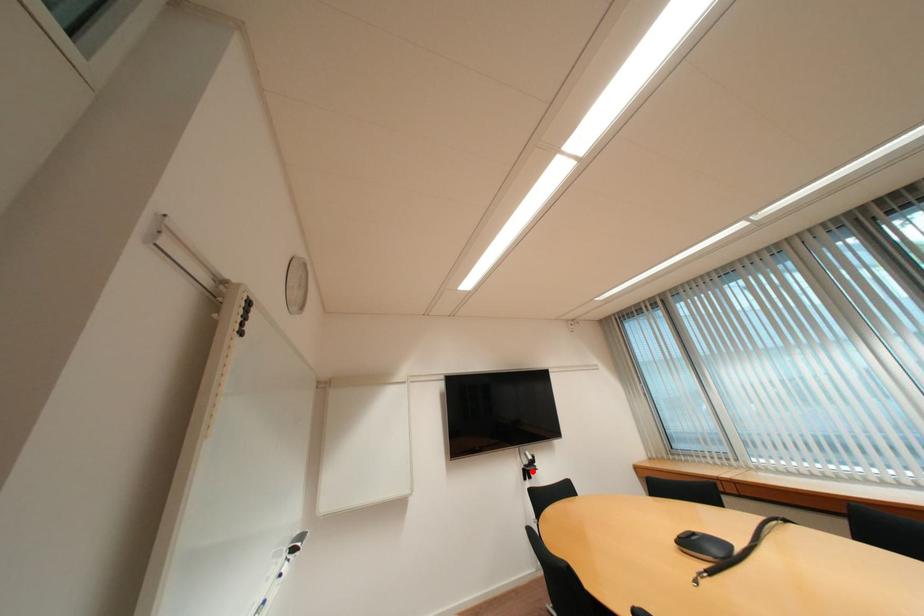
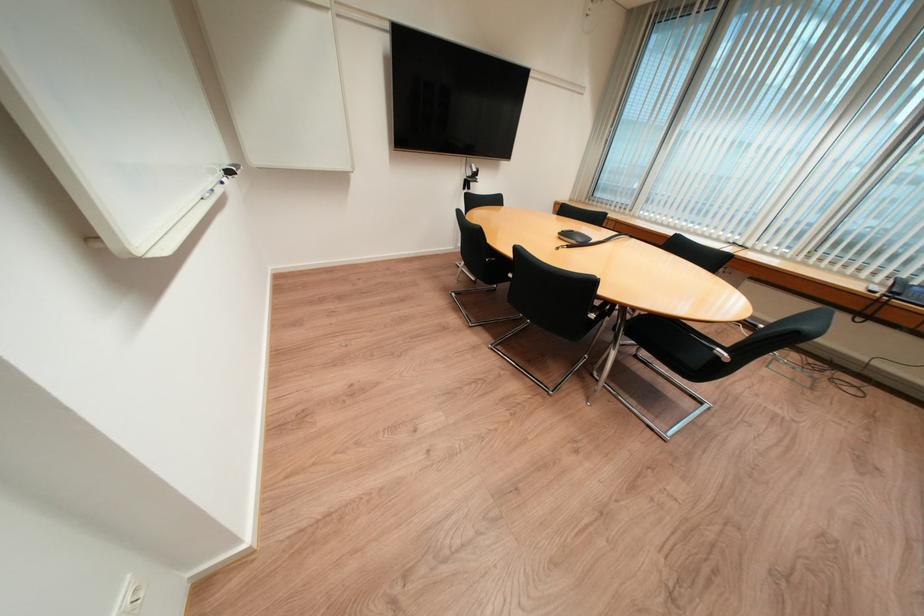
Locate, in the second image, the point that corresponds to the highlighted location in the first image.

(473, 182)